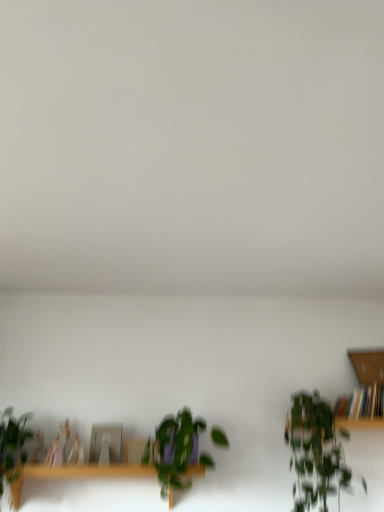
Question: Are wooden table at lower center and green leafy plant at right, marked as the first houseplant in a right-to-left arrangement, beside each other?

Choices:
 (A) no
 (B) yes

Answer: (A)

Question: Can you confirm if wooden table at lower center is smaller than green leafy plant at right, marked as the first houseplant in a right-to-left arrangement?

Choices:
 (A) no
 (B) yes

Answer: (B)

Question: From the image's perspective, would you say wooden table at lower center is positioned over green leafy plant at right, the third houseplant positioned from the left?

Choices:
 (A) yes
 (B) no

Answer: (B)

Question: Is wooden table at lower center further to the viewer compared to green leafy plant at right, marked as the first houseplant in a right-to-left arrangement?

Choices:
 (A) yes
 (B) no

Answer: (A)

Question: Does wooden table at lower center have a greater width compared to green leafy plant at right, the third houseplant positioned from the left?

Choices:
 (A) yes
 (B) no

Answer: (B)

Question: Is green leafy plant at right, the third houseplant positioned from the left, taller or shorter than green leafy plant at center, which appears as the 2th houseplant when viewed from the left?

Choices:
 (A) short
 (B) tall

Answer: (B)

Question: Is green leafy plant at right, the third houseplant positioned from the left, inside or outside of green leafy plant at center, which appears as the 2th houseplant when viewed from the right?

Choices:
 (A) inside
 (B) outside

Answer: (B)

Question: Considering the positions of green leafy plant at right, the third houseplant positioned from the left, and green leafy plant at center, which appears as the 2th houseplant when viewed from the left, in the image, is green leafy plant at right, the third houseplant positioned from the left, wider or thinner than green leafy plant at center, which appears as the 2th houseplant when viewed from the left,?

Choices:
 (A) wide
 (B) thin

Answer: (A)

Question: Visually, is green leafy plant at right, the third houseplant positioned from the left, positioned to the left or to the right of green leafy plant at center, which appears as the 2th houseplant when viewed from the left?

Choices:
 (A) right
 (B) left

Answer: (A)

Question: Is green leafy plant at right, the third houseplant positioned from the left, inside the boundaries of green matte plant at lower left, which ranks as the first houseplant in left-to-right order, or outside?

Choices:
 (A) outside
 (B) inside

Answer: (A)

Question: Is green leafy plant at right, marked as the first houseplant in a right-to-left arrangement, wider or thinner than green matte plant at lower left, which ranks as the first houseplant in left-to-right order?

Choices:
 (A) wide
 (B) thin

Answer: (A)

Question: Considering the positions of point (311, 424) and point (16, 428), is point (311, 424) closer or farther from the camera than point (16, 428)?

Choices:
 (A) farther
 (B) closer

Answer: (A)

Question: From the image's perspective, relative to green matte plant at lower left, which ranks as the first houseplant in left-to-right order, is green leafy plant at right, the third houseplant positioned from the left, above or below?

Choices:
 (A) above
 (B) below

Answer: (B)

Question: In the image, is wooden bookshelf at right positioned in front of or behind wooden table at lower center?

Choices:
 (A) front
 (B) behind

Answer: (B)

Question: Considering the positions of wooden bookshelf at right and wooden table at lower center in the image, is wooden bookshelf at right taller or shorter than wooden table at lower center?

Choices:
 (A) tall
 (B) short

Answer: (B)